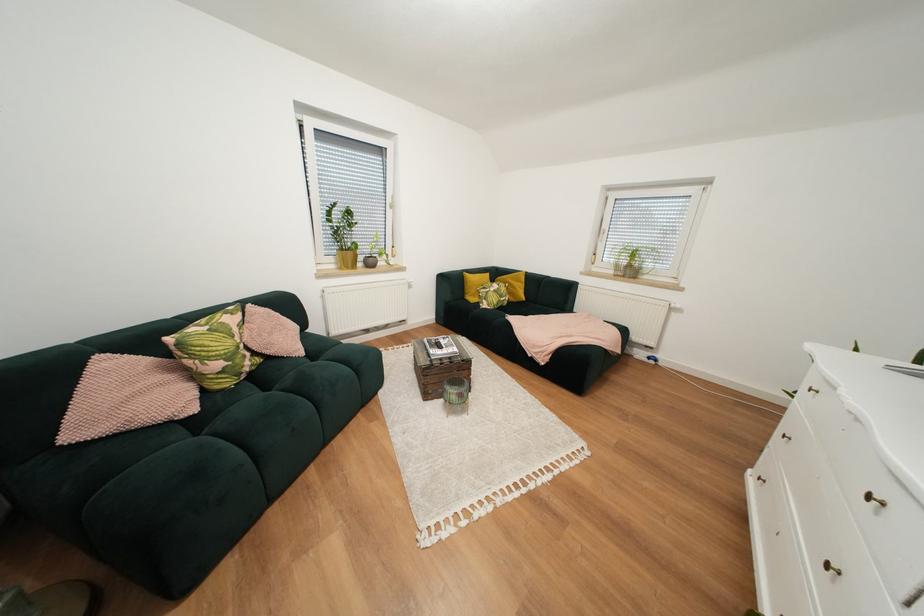
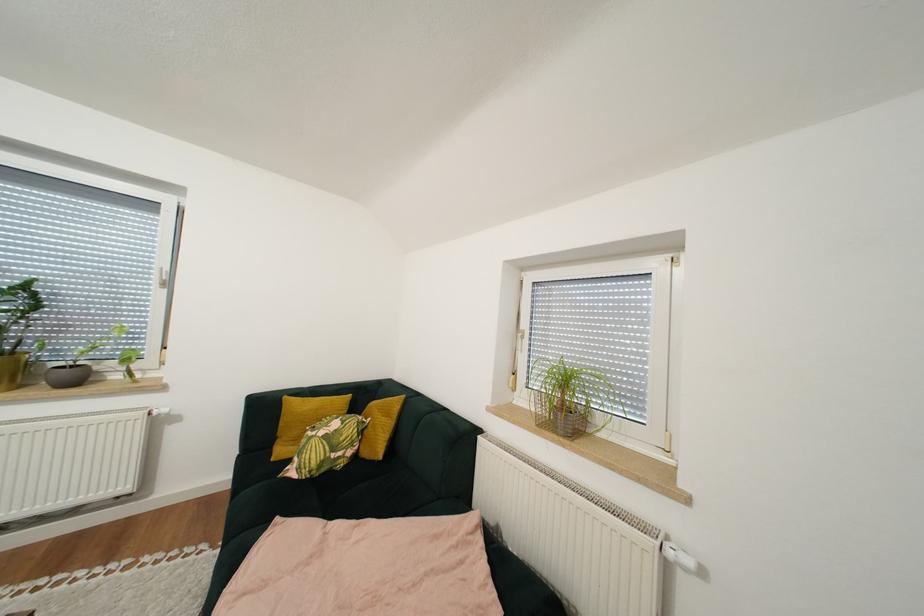
In a continuous first-person perspective shot, in which direction is the camera moving?

The cameraman walked toward right, forward.